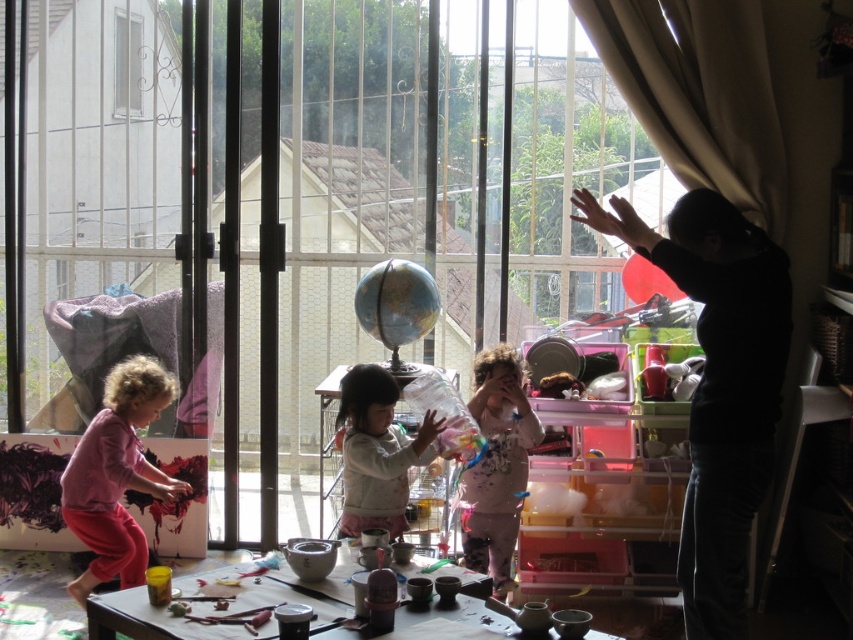
Question: Which point is closer to the camera?

Choices:
 (A) soft pink sweater at center
 (B) rubber balloon at center

Answer: (A)

Question: Is black matte shirt at upper right below paint-splattered fabric at center?

Choices:
 (A) yes
 (B) no

Answer: (B)

Question: Which object appears closest to the camera in this image?

Choices:
 (A) rubber balloon at center
 (B) pink fabric at left

Answer: (B)

Question: Can you confirm if clear glass window at upper left is wider than red matte balloon at upper right?

Choices:
 (A) yes
 (B) no

Answer: (B)

Question: Which point is farther to the camera?

Choices:
 (A) soft pink sweater at center
 (B) red matte balloon at upper right
 (C) clear glass window at upper left
 (D) pink fabric at left

Answer: (C)

Question: Does pink fabric at left appear over soft pink sweater at center?

Choices:
 (A) no
 (B) yes

Answer: (A)